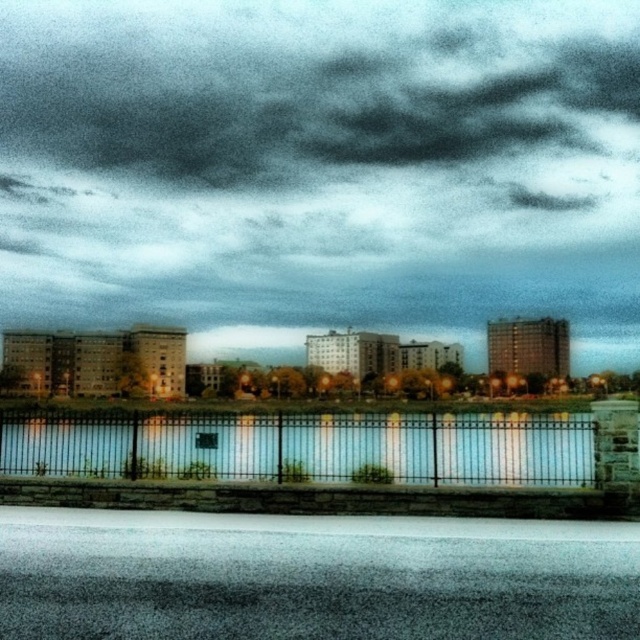
You are a city planner assessing the potential for a new billboard installation between the dark gray cloud at upper center and the black metal fence at center. Considering their relative heights, which object would you need to consider for visibility concerns?

The dark gray cloud at upper center is much taller than the black metal fence at center, so the billboard installation should consider the height of the dark gray cloud at upper center to ensure visibility.

Based on the photo, you are standing in the city at dusk and see the dark gray cloud at upper center. If you want to measure its distance using a laser rangefinder, what would the reading be?

The dark gray cloud at upper center is 56.77 meters from the viewer, so the laser rangefinder would display a reading of 56.77 meters.

You are a city planner reviewing this area. You need to determine if the dark gray cloud at upper center will block the view of the black metal fence at center from a vantage point on the ground. Based on their sizes, can you estimate if the cloud might obscure the fence?

The dark gray cloud at upper center has a larger width than the black metal fence at center, so it is possible that the cloud could block the view of the fence depending on their relative positions and distance from the observer.